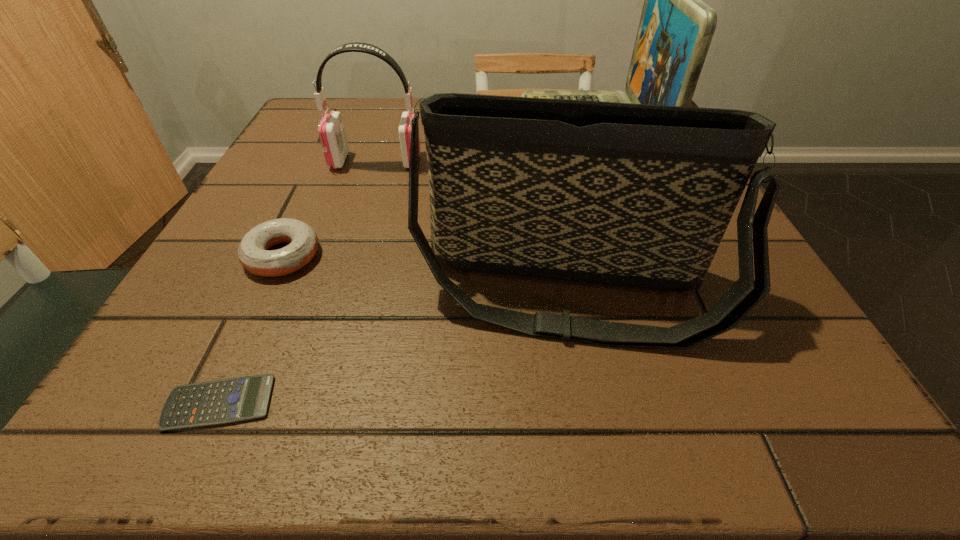
Identify the location of vacant position located on the outer surface of the earphone. (586, 161).

What are the coordinates of `free point located 0.270m on the right of the doughnut` in the screenshot? It's located at (491, 256).

The width and height of the screenshot is (960, 540). I want to click on free space located on the back of the calculator, so click(285, 260).

Image resolution: width=960 pixels, height=540 pixels. Find the location of `object located at the far edge`. object located at the far edge is located at coordinates (676, 27).

This screenshot has width=960, height=540. I want to click on object present at the near edge, so click(x=230, y=400).

Identify the location of earphone present at the left edge. (331, 131).

You are a GUI agent. You are given a task and a screenshot of the screen. Output one action in this format:
    pyautogui.click(x=<x>, y=<y>)
    Task: Click on the doughnut located at the left edge
    The height and width of the screenshot is (540, 960).
    Given the screenshot: What is the action you would take?
    pyautogui.click(x=253, y=253)

At what (x,y) coordinates should I click in order to perform the action: click on calculator that is at the left edge. Please return your answer as a coordinate pair (x, y). This screenshot has width=960, height=540. Looking at the image, I should click on (230, 400).

The height and width of the screenshot is (540, 960). I want to click on laptop computer at the right edge, so click(x=676, y=27).

Where is `handbag present at the right edge`? handbag present at the right edge is located at coordinates (637, 195).